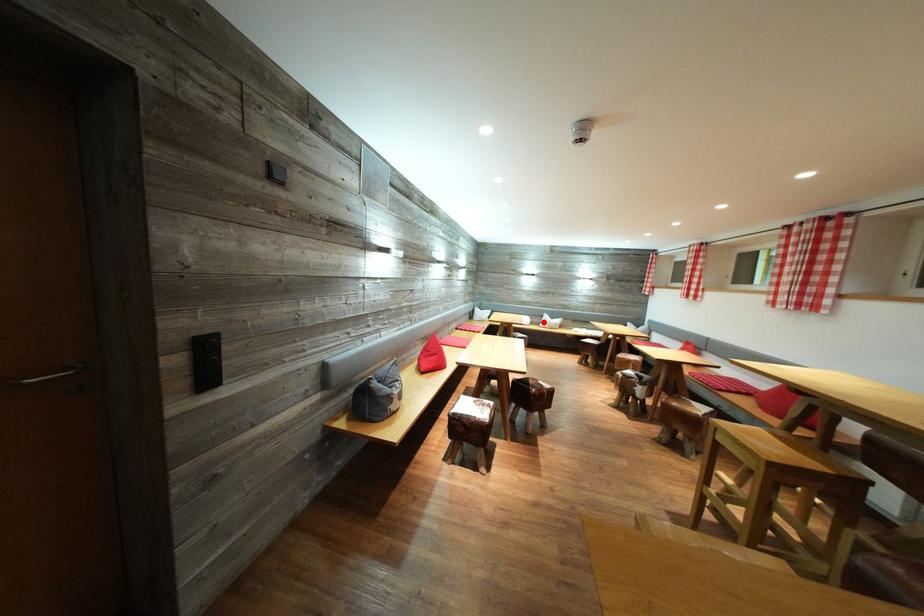
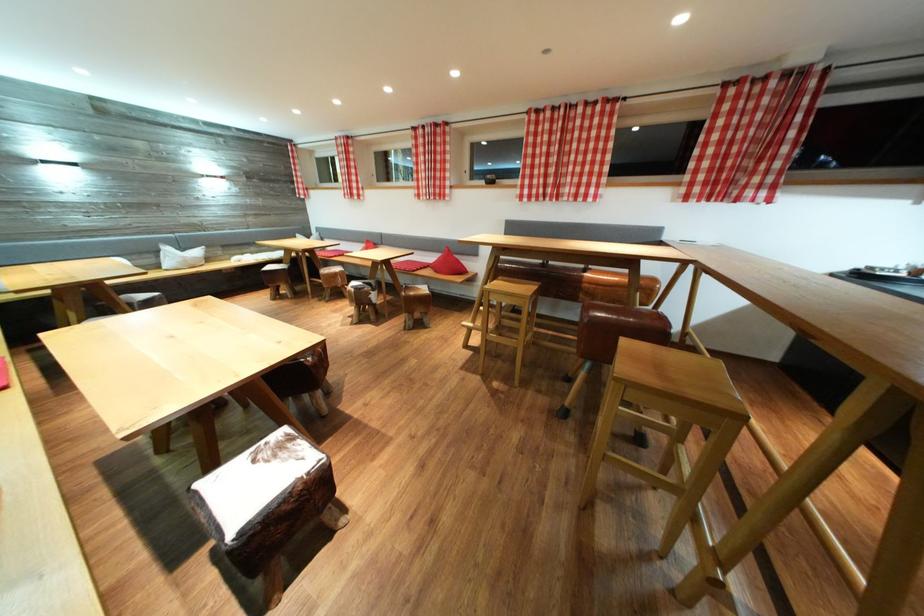
In the second image, find the point that corresponds to the highlighted location in the first image.

(151, 259)